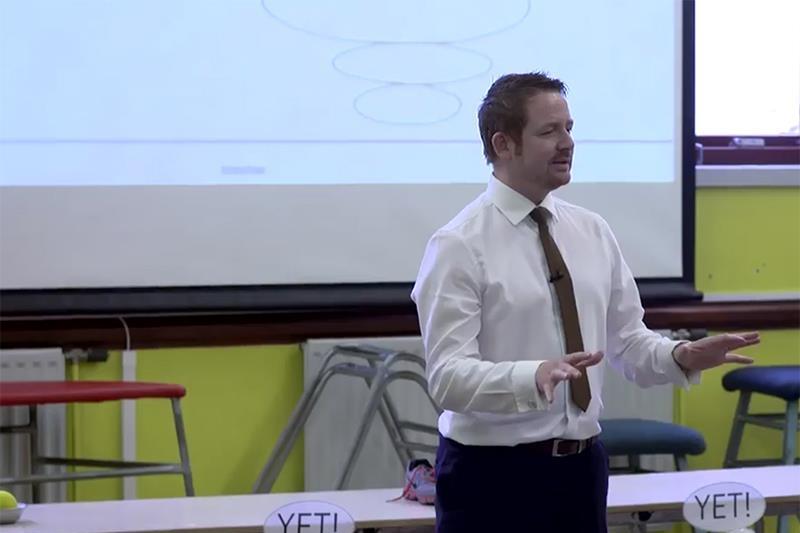
Where is `yellow wall`? This screenshot has width=800, height=533. yellow wall is located at coordinates (757, 245).